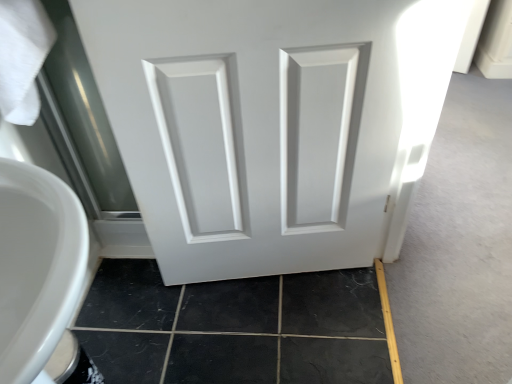
This screenshot has width=512, height=384. Identify the location of white matte door at center. (252, 128).

What do you see at coordinates (252, 128) in the screenshot? I see `white matte door at center` at bounding box center [252, 128].

Identify the location of black tile at lower left. The width and height of the screenshot is (512, 384). (234, 328).

The height and width of the screenshot is (384, 512). Describe the element at coordinates (234, 328) in the screenshot. I see `black tile at lower left` at that location.

Where is `white matte door at center`? This screenshot has height=384, width=512. white matte door at center is located at coordinates (252, 128).

Which object is positioned more to the left, white matte door at center or black tile at lower left?

black tile at lower left is more to the left.

Which is behind, white matte door at center or black tile at lower left?

black tile at lower left is further away from the camera.

Does point (157, 170) lie behind point (325, 282)?

No, it is not.

From the image's perspective, which is above, white matte door at center or black tile at lower left?

From the image's view, white matte door at center is above.

From a real-world perspective, which is physically below, white matte door at center or black tile at lower left?

In real-world perspective, black tile at lower left is lower.

Between white matte door at center and black tile at lower left, which one has smaller width?

white matte door at center.

From their relative heights in the image, would you say white matte door at center is taller or shorter than black tile at lower left?

In the image, white matte door at center appears to be taller than black tile at lower left.

Who is bigger, white matte door at center or black tile at lower left?

white matte door at center.

Which is correct: white matte door at center is inside black tile at lower left, or outside of it?

white matte door at center is not inside black tile at lower left, it's outside.

Is white matte door at center next to black tile at lower left and touching it?

No, white matte door at center is not touching black tile at lower left.

Is white matte door at center facing away from black tile at lower left?

No, white matte door at center is not facing the opposite direction of black tile at lower left.

Based on the photo, can you tell me how much white matte door at center and black tile at lower left differ in facing direction?

81.1 degrees separate the facing orientations of white matte door at center and black tile at lower left.

Measure the distance between white matte door at center and black tile at lower left.

They are 15.63 inches apart.

Where is `door above the black tile at lower left (from a real-world perspective)`? door above the black tile at lower left (from a real-world perspective) is located at coordinates (252, 128).

Considering the positions of objects black tile at lower left and white matte door at center in the image provided, who is more to the right, black tile at lower left or white matte door at center?

Positioned to the right is white matte door at center.

Which object is closer to the camera, black tile at lower left or white matte door at center?

Positioned in front is white matte door at center.

Which is closer to the camera, (247,318) or (285,91)?

Positioned in front is point (285,91).

From the image's perspective, which one is positioned lower, black tile at lower left or white matte door at center?

black tile at lower left, from the image's perspective.

Consider the image. From a real-world perspective, relative to white matte door at center, is black tile at lower left vertically above or below?

black tile at lower left is below white matte door at center.

Between black tile at lower left and white matte door at center, which one has larger width?

black tile at lower left.

Considering the relative sizes of black tile at lower left and white matte door at center in the image provided, is black tile at lower left shorter than white matte door at center?

Indeed, black tile at lower left has a lesser height compared to white matte door at center.

Can you confirm if black tile at lower left is smaller than white matte door at center?

Indeed, black tile at lower left has a smaller size compared to white matte door at center.

Would you say black tile at lower left is inside or outside white matte door at center?

black tile at lower left is outside white matte door at center.

Does black tile at lower left touch white matte door at center?

No, black tile at lower left is not with white matte door at center.

Could you tell me if black tile at lower left is turned towards white matte door at center?

No, black tile at lower left is not aimed at white matte door at center.

How different are the orientations of black tile at lower left and white matte door at center in degrees?

The angular difference between black tile at lower left and white matte door at center is 81.1 degrees.

How far apart are black tile at lower left and white matte door at center?

A distance of 15.63 inches exists between black tile at lower left and white matte door at center.

Locate an element on the screen. The image size is (512, 384). tile below the white matte door at center (from a real-world perspective) is located at coordinates (234, 328).

I want to click on tile located on the left of white matte door at center, so click(x=234, y=328).

Find the location of a particular element. The height and width of the screenshot is (384, 512). door above the black tile at lower left (from a real-world perspective) is located at coordinates (252, 128).